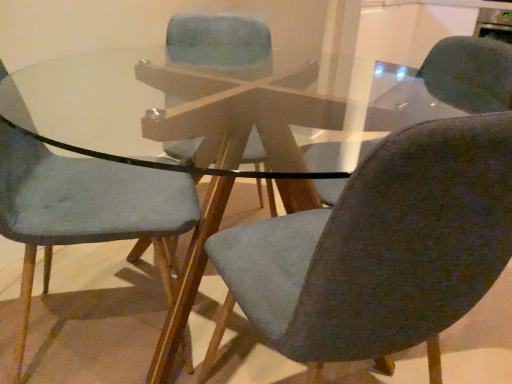
Question: Is matte gray chair at left, the 1th chair positioned from the left, completely or partially inside textured gray chair at center, the third chair in the left-to-right sequence?

Choices:
 (A) no
 (B) yes

Answer: (A)

Question: Can you see textured gray chair at center, the third chair in the left-to-right sequence, touching matte gray chair at left, the 1th chair positioned from the left?

Choices:
 (A) yes
 (B) no

Answer: (B)

Question: Considering the relative positions of textured gray chair at center, the third chair in the left-to-right sequence, and matte gray chair at left, the 3th chair from the right, in the image provided, is textured gray chair at center, the third chair in the left-to-right sequence, to the right of matte gray chair at left, the 3th chair from the right, from the viewer's perspective?

Choices:
 (A) no
 (B) yes

Answer: (B)

Question: Is textured gray chair at center, marked as the 1th chair in a right-to-left arrangement, further to the viewer compared to matte gray chair at left, the 1th chair positioned from the left?

Choices:
 (A) yes
 (B) no

Answer: (B)

Question: Considering the relative sizes of textured gray chair at center, the third chair in the left-to-right sequence, and matte gray chair at left, the 1th chair positioned from the left, in the image provided, is textured gray chair at center, the third chair in the left-to-right sequence, bigger than matte gray chair at left, the 1th chair positioned from the left,?

Choices:
 (A) no
 (B) yes

Answer: (B)

Question: Considering the relative sizes of textured gray chair at center, the third chair in the left-to-right sequence, and matte gray chair at left, the 3th chair from the right, in the image provided, is textured gray chair at center, the third chair in the left-to-right sequence, smaller than matte gray chair at left, the 3th chair from the right,?

Choices:
 (A) yes
 (B) no

Answer: (B)

Question: Considering the relative sizes of textured gray chair at center, marked as the 1th chair in a right-to-left arrangement, and textured fabric chair at center, placed as the second chair when sorted from left to right, in the image provided, is textured gray chair at center, marked as the 1th chair in a right-to-left arrangement, smaller than textured fabric chair at center, placed as the second chair when sorted from left to right,?

Choices:
 (A) no
 (B) yes

Answer: (A)

Question: Can you confirm if textured gray chair at center, the third chair in the left-to-right sequence, is wider than textured fabric chair at center, marked as the 2th chair in a right-to-left arrangement?

Choices:
 (A) no
 (B) yes

Answer: (B)

Question: Is textured gray chair at center, marked as the 1th chair in a right-to-left arrangement, further to the viewer compared to textured fabric chair at center, placed as the second chair when sorted from left to right?

Choices:
 (A) no
 (B) yes

Answer: (A)

Question: Is textured gray chair at center, marked as the 1th chair in a right-to-left arrangement, to the right of textured fabric chair at center, marked as the 2th chair in a right-to-left arrangement, from the viewer's perspective?

Choices:
 (A) yes
 (B) no

Answer: (A)

Question: Does textured gray chair at center, the third chair in the left-to-right sequence, appear on the left side of textured fabric chair at center, marked as the 2th chair in a right-to-left arrangement?

Choices:
 (A) no
 (B) yes

Answer: (A)

Question: Is textured fabric chair at center, placed as the second chair when sorted from left to right, inside textured gray chair at center, the third chair in the left-to-right sequence?

Choices:
 (A) yes
 (B) no

Answer: (B)

Question: From a real-world perspective, is textured fabric chair at center, placed as the second chair when sorted from left to right, physically above textured gray chair at center, the third chair in the left-to-right sequence?

Choices:
 (A) yes
 (B) no

Answer: (A)